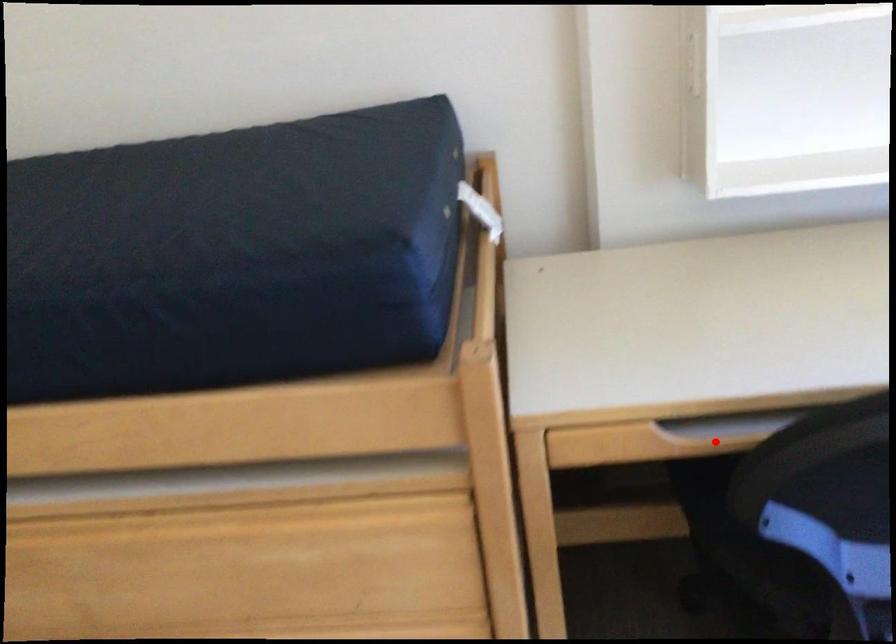
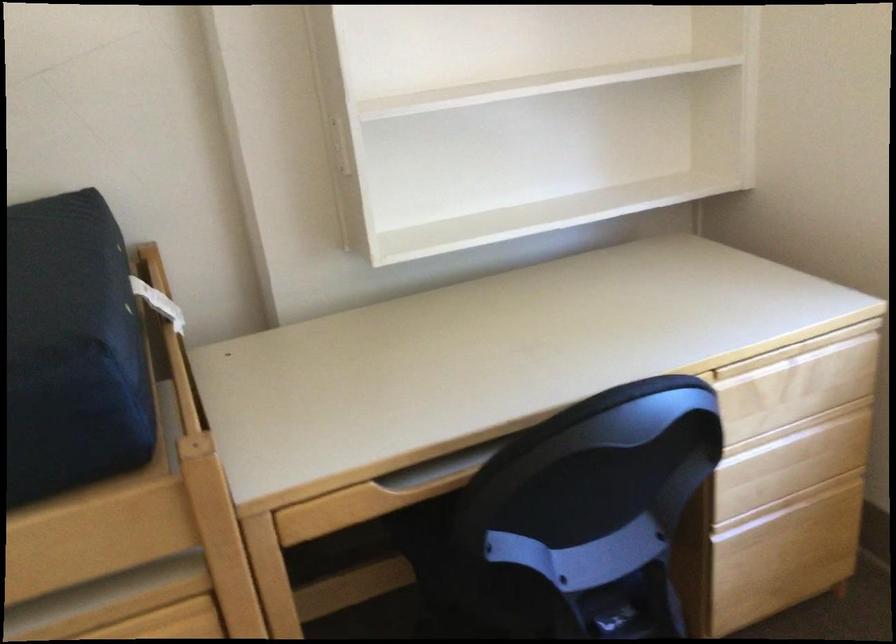
Find the pixel in the second image that matches the highlighted location in the first image.

(431, 489)